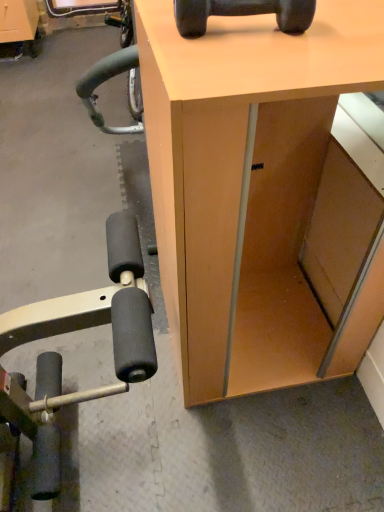
Locate an element on the screen. The height and width of the screenshot is (512, 384). matte wood desk at center is located at coordinates (262, 196).

What do you see at coordinates (262, 196) in the screenshot? The width and height of the screenshot is (384, 512). I see `matte wood desk at center` at bounding box center [262, 196].

The width and height of the screenshot is (384, 512). Describe the element at coordinates (242, 13) in the screenshot. I see `black rubber dumbbell at upper center` at that location.

Measure the distance between black rubber dumbbell at upper center and camera.

They are 26.74 inches apart.

Where is `black rubber dumbbell at upper center`? This screenshot has width=384, height=512. black rubber dumbbell at upper center is located at coordinates (242, 13).

Locate an element on the screen. matte wood desk at center is located at coordinates (262, 196).

Which object is positioned more to the right, black rubber dumbbell at upper center or matte wood desk at center?

matte wood desk at center is more to the right.

Is the depth of black rubber dumbbell at upper center less than that of matte wood desk at center?

No, it is not.

Is point (174, 3) positioned before point (268, 105)?

Yes, point (174, 3) is closer to viewer.

From the image's perspective, does black rubber dumbbell at upper center appear higher than matte wood desk at center?

Yes, from the image's perspective, black rubber dumbbell at upper center is over matte wood desk at center.

From a real-world perspective, is black rubber dumbbell at upper center over matte wood desk at center?

Yes, from a real-world perspective, black rubber dumbbell at upper center is on top of matte wood desk at center.

Does black rubber dumbbell at upper center have a lesser width compared to matte wood desk at center?

Yes, black rubber dumbbell at upper center is thinner than matte wood desk at center.

Considering the sizes of objects black rubber dumbbell at upper center and matte wood desk at center in the image provided, who is taller, black rubber dumbbell at upper center or matte wood desk at center?

matte wood desk at center.

Can you confirm if black rubber dumbbell at upper center is smaller than matte wood desk at center?

Indeed, black rubber dumbbell at upper center has a smaller size compared to matte wood desk at center.

Is black rubber dumbbell at upper center inside or outside of matte wood desk at center?

black rubber dumbbell at upper center exists outside the volume of matte wood desk at center.

Is black rubber dumbbell at upper center with matte wood desk at center?

There is a gap between black rubber dumbbell at upper center and matte wood desk at center.

Is black rubber dumbbell at upper center oriented towards matte wood desk at center?

No, black rubber dumbbell at upper center is not aimed at matte wood desk at center.

Find the location of a particular element. This screenshot has height=512, width=384. desk located underneath the black rubber dumbbell at upper center (from a real-world perspective) is located at coordinates (262, 196).

Which is more to the left, matte wood desk at center or black rubber dumbbell at upper center?

From the viewer's perspective, black rubber dumbbell at upper center appears more on the left side.

Considering their positions, is matte wood desk at center located in front of or behind black rubber dumbbell at upper center?

matte wood desk at center is in front of black rubber dumbbell at upper center.

Does point (209, 127) lie behind point (203, 0)?

No, it is in front of (203, 0).

From the image's perspective, is matte wood desk at center above black rubber dumbbell at upper center?

No.

From a real-world perspective, is matte wood desk at center positioned above or below black rubber dumbbell at upper center?

matte wood desk at center is below black rubber dumbbell at upper center.

Can you confirm if matte wood desk at center is wider than black rubber dumbbell at upper center?

Yes.

Can you confirm if matte wood desk at center is shorter than black rubber dumbbell at upper center?

In fact, matte wood desk at center may be taller than black rubber dumbbell at upper center.

Between matte wood desk at center and black rubber dumbbell at upper center, which one has smaller size?

black rubber dumbbell at upper center.

Is black rubber dumbbell at upper center surrounded by matte wood desk at center?

No, black rubber dumbbell at upper center is not surrounded by matte wood desk at center.

Is matte wood desk at center positioned far away from black rubber dumbbell at upper center?

That's not correct — matte wood desk at center is a little close to black rubber dumbbell at upper center.

Could you tell me if matte wood desk at center is facing black rubber dumbbell at upper center?

No, matte wood desk at center does not turn towards black rubber dumbbell at upper center.

What's the angular difference between matte wood desk at center and black rubber dumbbell at upper center's facing directions?

The facing directions of matte wood desk at center and black rubber dumbbell at upper center are 1.64 degrees apart.

Locate an element on the screen. The height and width of the screenshot is (512, 384). dumbbell lying above the matte wood desk at center (from the image's perspective) is located at coordinates (242, 13).

Locate an element on the screen. Image resolution: width=384 pixels, height=512 pixels. desk located below the black rubber dumbbell at upper center (from the image's perspective) is located at coordinates (262, 196).

You are a GUI agent. You are given a task and a screenshot of the screen. Output one action in this format:
    pyautogui.click(x=<x>, y=<y>)
    Task: Click on the dumbbell above the matte wood desk at center (from a real-world perspective)
    Image resolution: width=384 pixels, height=512 pixels.
    Given the screenshot: What is the action you would take?
    pyautogui.click(x=242, y=13)